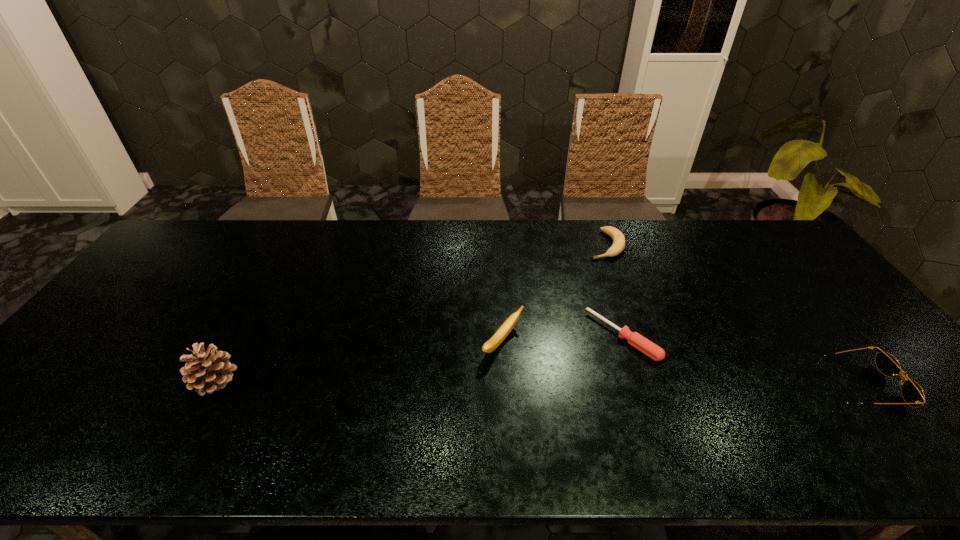
The height and width of the screenshot is (540, 960). In order to click on free space on the desktop that is between the tallest object and the sunglasses and is positioned at the stem of the farthest object in this screenshot , I will do `click(583, 383)`.

Find the location of `vacant space on the desktop that is between the tallest object and the rightmost object and is positioned at the tip of the shortest object`. vacant space on the desktop that is between the tallest object and the rightmost object and is positioned at the tip of the shortest object is located at coordinates [x=569, y=383].

Where is `vacant space on the desktop that is between the leftmost object and the rightmost object and is positioned at the stem of the second object from left to right`? Image resolution: width=960 pixels, height=540 pixels. vacant space on the desktop that is between the leftmost object and the rightmost object and is positioned at the stem of the second object from left to right is located at coordinates (596, 384).